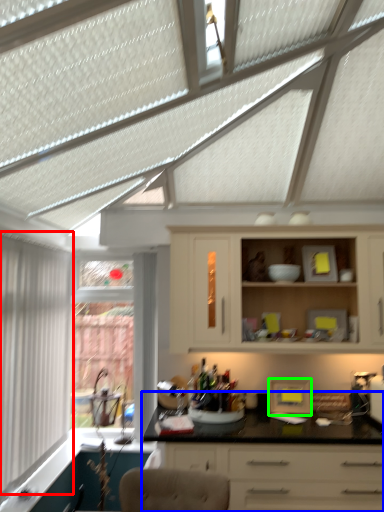
Question: Based on their relative distances, which object is farther from window (highlighted by a red box)? Choose from countertop (highlighted by a blue box) and appliance (highlighted by a green box).

Choices:
 (A) countertop
 (B) appliance

Answer: (B)